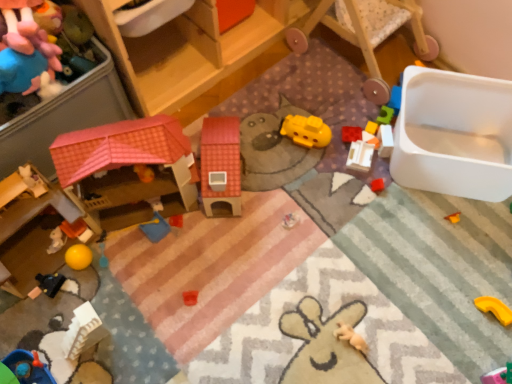
Locate an element on the screen. This screenshot has width=512, height=384. vacant space that's between white plastic blocks at right, which is the second toy in right-to-left order, and black matte toy car at lower left, the tenth toy viewed from the right is located at coordinates (232, 213).